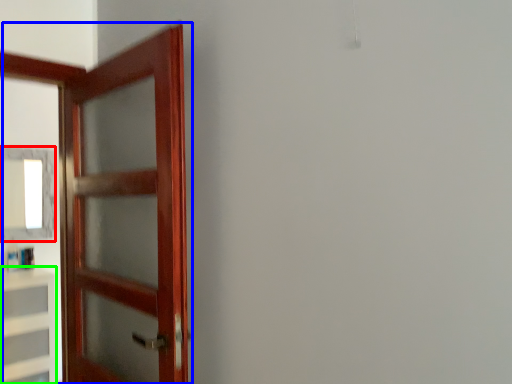
Question: Estimate the real-world distances between objects in this image. Which object is closer to mirror (highlighted by a red box), door (highlighted by a blue box) or cabinetry (highlighted by a green box)?

Choices:
 (A) door
 (B) cabinetry

Answer: (B)